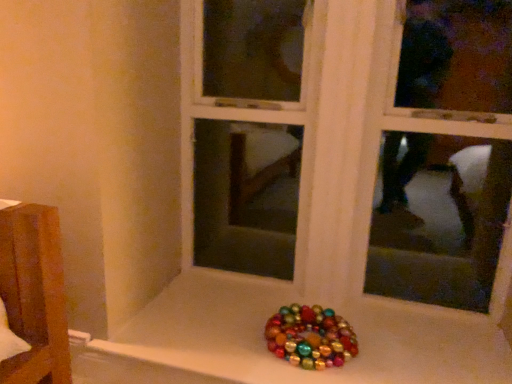
This screenshot has height=384, width=512. Find the location of `unoccupied area behind multicolored glossy beads at bottom center`. unoccupied area behind multicolored glossy beads at bottom center is located at coordinates (283, 304).